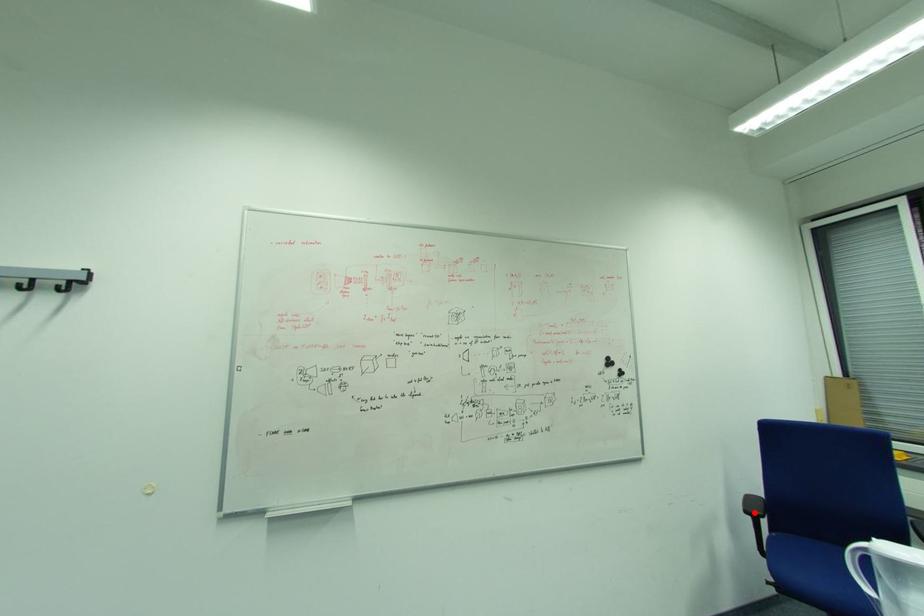
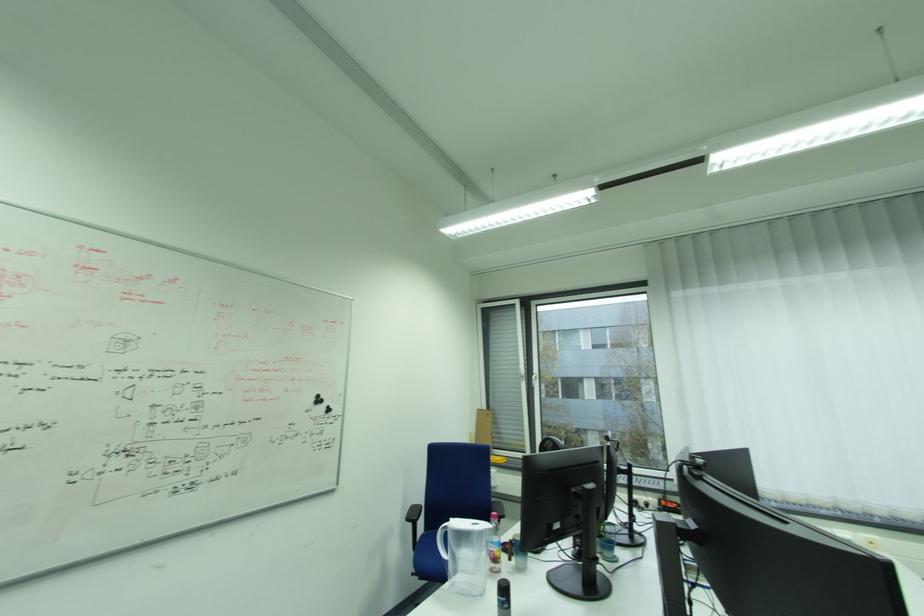
In the second image, find the point that corresponds to the highlighted location in the first image.

(415, 521)